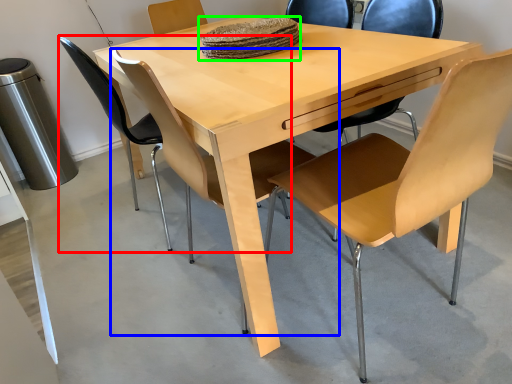
Question: Based on their relative distances, which object is farther from chair (highlighted by a red box)? Choose from chair (highlighted by a blue box) and food (highlighted by a green box).

Choices:
 (A) chair
 (B) food

Answer: (B)